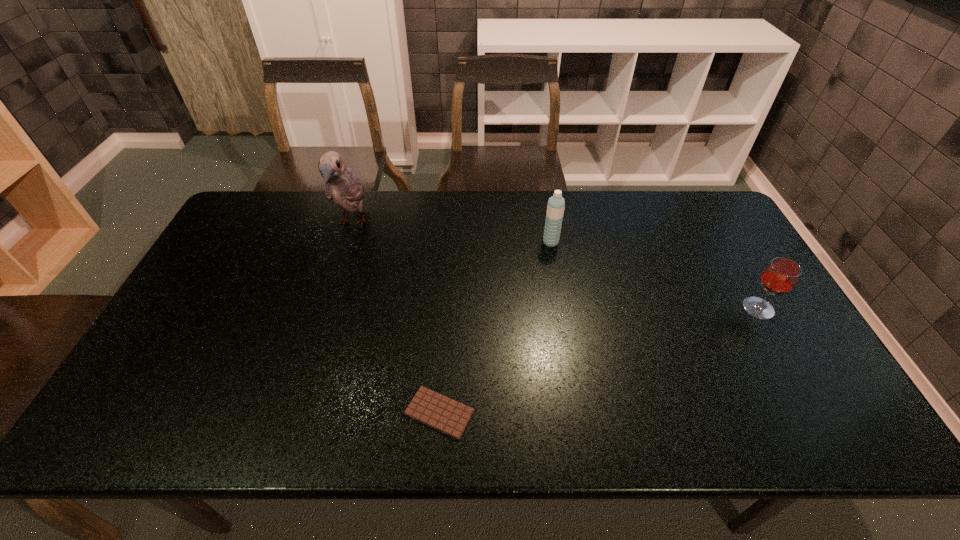
Find the location of a particular element. The width and height of the screenshot is (960, 540). the leftmost object is located at coordinates (342, 185).

The width and height of the screenshot is (960, 540). I want to click on the tallest object, so click(342, 185).

Image resolution: width=960 pixels, height=540 pixels. I want to click on the third object from left to right, so click(x=556, y=204).

Where is `the second tallest object`? the second tallest object is located at coordinates (556, 204).

The width and height of the screenshot is (960, 540). I want to click on the second nearest object, so click(781, 275).

In order to click on the rightmost object in this screenshot , I will do `click(781, 275)`.

Identify the location of the second object from left to right. (442, 413).

This screenshot has height=540, width=960. I want to click on the shortest object, so click(442, 413).

The height and width of the screenshot is (540, 960). I want to click on vacant region located 0.330m on the front-facing side of the leftmost object, so click(319, 334).

Where is `free region located on the left of the second object from right to left`? The height and width of the screenshot is (540, 960). free region located on the left of the second object from right to left is located at coordinates (492, 242).